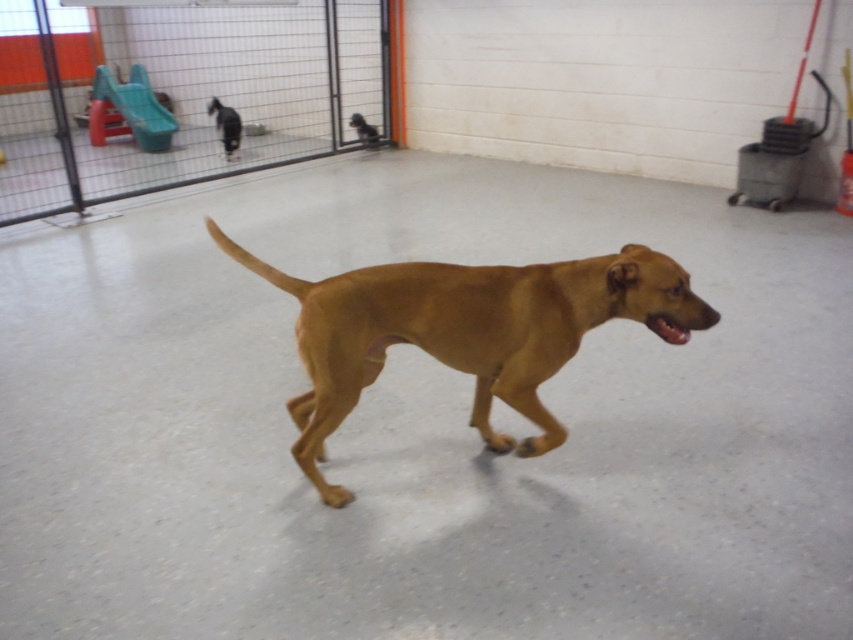
Question: Is golden brown fur at center smaller than brown matte dog at center?

Choices:
 (A) yes
 (B) no

Answer: (B)

Question: Which object is closer to the camera taking this photo?

Choices:
 (A) golden brown fur at center
 (B) brown matte dog at center

Answer: (A)

Question: Does wire mesh fence at upper left appear over brown matte dog at center?

Choices:
 (A) no
 (B) yes

Answer: (B)

Question: Based on their relative distances, which object is nearer to the brown matte dog at center?

Choices:
 (A) golden brown fur at center
 (B) wire mesh fence at upper left
 (C) shiny black dog at upper left

Answer: (C)

Question: Which object is positioned closest to the shiny black dog at upper left?

Choices:
 (A) brown matte dog at center
 (B) wire mesh fence at upper left
 (C) golden brown fur at center

Answer: (A)

Question: Can you confirm if golden brown fur at center is positioned to the left of brown matte dog at center?

Choices:
 (A) yes
 (B) no

Answer: (B)